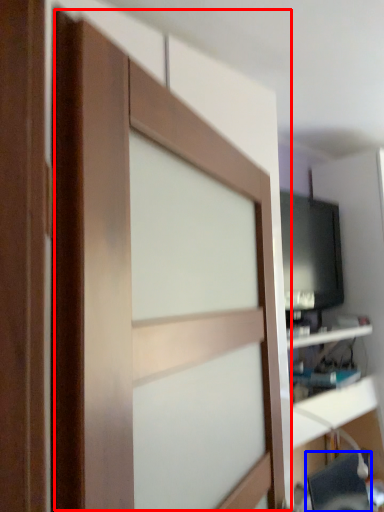
Question: Among these objects, which one is farthest to the camera, barn door (highlighted by a red box) or computer chair (highlighted by a blue box)?

Choices:
 (A) barn door
 (B) computer chair

Answer: (B)